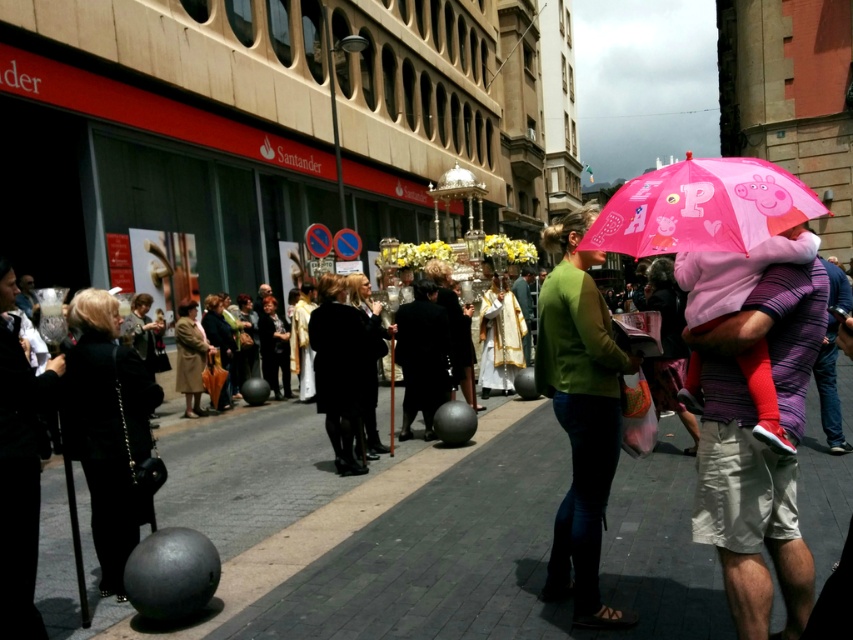
You are a photographer trying to capture the scene in front of you. You notice the pink fabric umbrella at right and the green matte sweater at center. Which object should you focus on to ensure it appears larger in your photo?

The pink fabric umbrella at right is in front of the green matte sweater at center, so focusing on it would make it appear larger in the photo.

You are a photographer trying to capture the scene of the religious procession. You notice the black leather jacket at lower left and the pink fabric umbrella at upper right. Which object should you focus on first if you want to capture both in a single frame without moving your camera?

The black leather jacket at lower left is located below the pink fabric umbrella at upper right, so focusing on the lower left object first would ensure both are within the frame.

You are a photographer wanting to capture both the pink fabric umbrella at right and the green matte sweater at center in a single shot. Which object should you focus on first to ensure both are in frame?

The pink fabric umbrella at right is smaller than the green matte sweater at center, so you should focus on the green matte sweater at center first to ensure both are in frame.